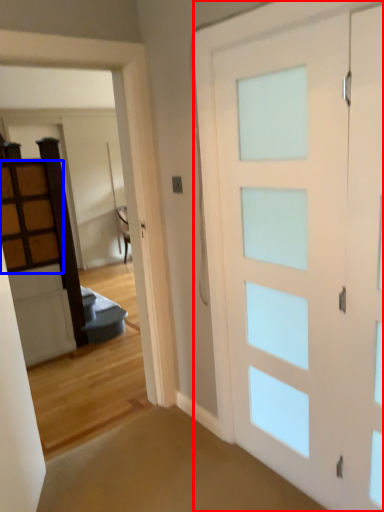
Question: Which of the following is the closest to the observer, barn door (highlighted by a red box) or cabinetry (highlighted by a blue box)?

Choices:
 (A) barn door
 (B) cabinetry

Answer: (A)